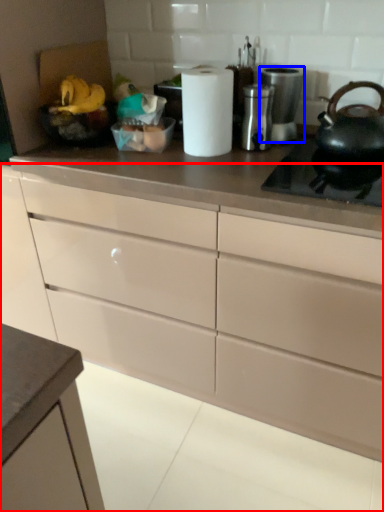
Question: Which of the following is the closest to the observer, cabinetry (highlighted by a red box) or appliance (highlighted by a blue box)?

Choices:
 (A) cabinetry
 (B) appliance

Answer: (A)